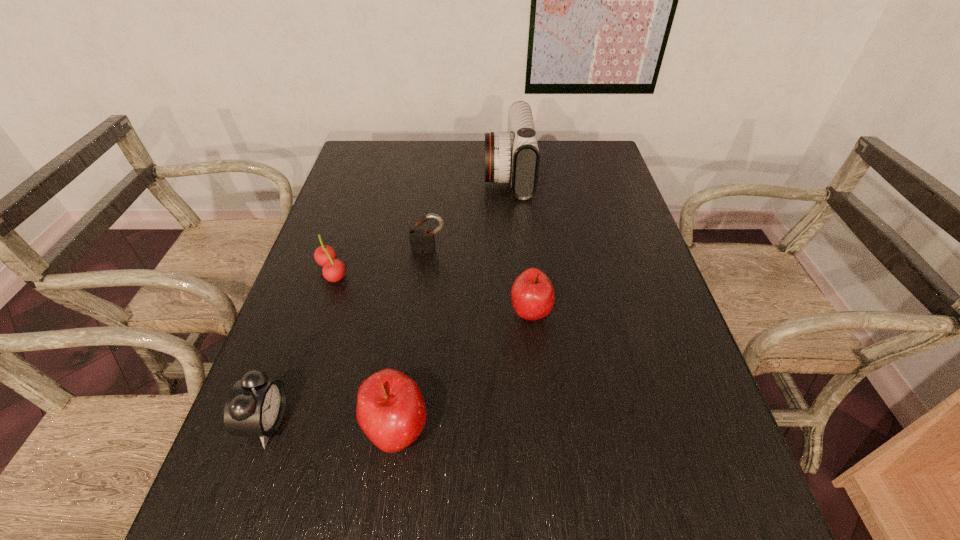
All apples are currently evenly spaced. To continue this pattern, where would you add another apple on the right? Please point out a vacant spot. Please provide its 2D coordinates. Your answer should be formatted as a tuple, i.e. [(x, y)], where the tuple contains the x and y coordinates of a point satisfying the conditions above.

[(619, 233)]